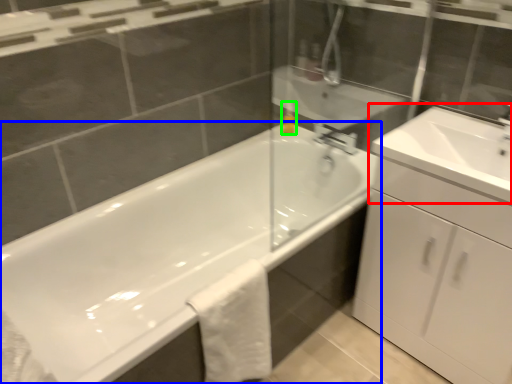
Question: Estimate the real-world distances between objects in this image. Which object is farther from sink (highlighted by a red box), bathtub (highlighted by a blue box) or soap dispenser (highlighted by a green box)?

Choices:
 (A) bathtub
 (B) soap dispenser

Answer: (A)